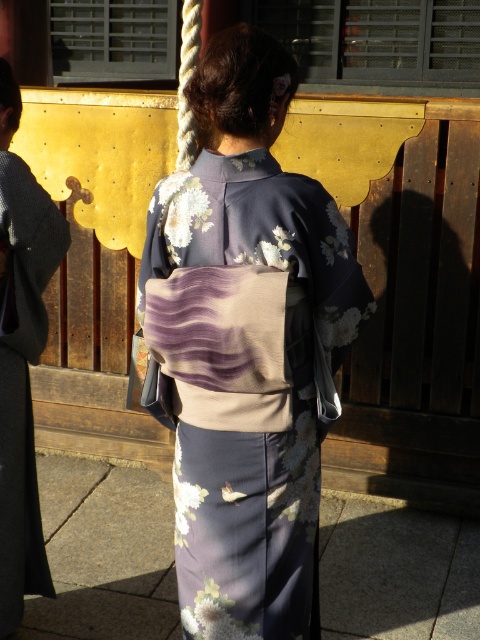
Based on the photo, is floral kimono at center further to the viewer compared to silky black kimono at center?

No.

Can you confirm if floral kimono at center is positioned to the right of silky black kimono at center?

Indeed, floral kimono at center is positioned on the right side of silky black kimono at center.

You are a GUI agent. You are given a task and a screenshot of the screen. Output one action in this format:
    pyautogui.click(x=<x>, y=<y>)
    Task: Click on the floral kimono at center
    The image size is (480, 640).
    Given the screenshot: What is the action you would take?
    pyautogui.click(x=247, y=348)